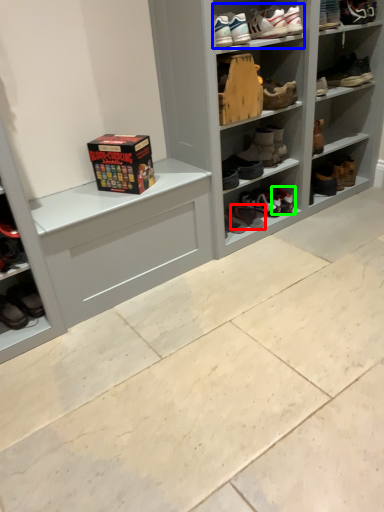
Question: Estimate the real-world distances between objects in this image. Which object is farther from footwear (highlighted by a red box), footwear (highlighted by a blue box) or footwear (highlighted by a green box)?

Choices:
 (A) footwear
 (B) footwear

Answer: (A)